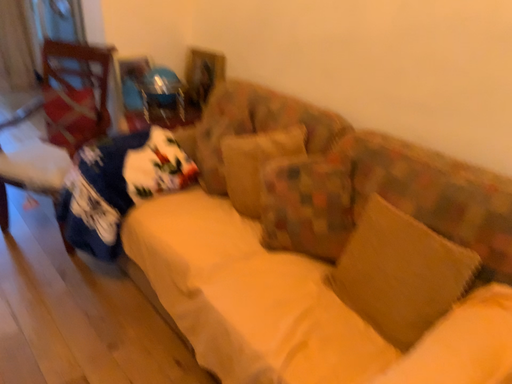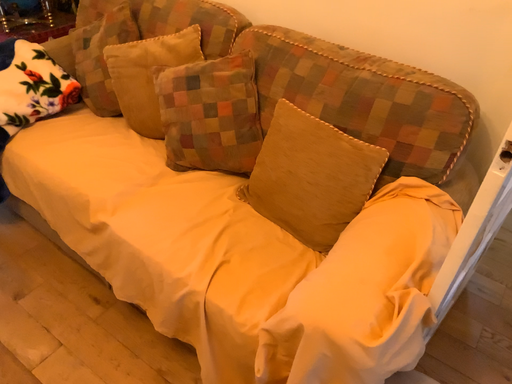
Question: Which way did the camera rotate in the video?

Choices:
 (A) rotated left
 (B) rotated right

Answer: (B)